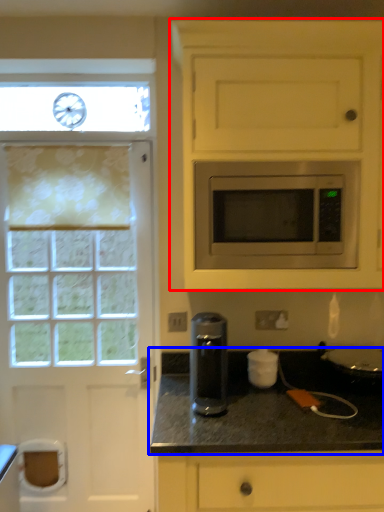
Question: Which object appears farthest to the camera in this image, cabinetry (highlighted by a red box) or countertop (highlighted by a blue box)?

Choices:
 (A) cabinetry
 (B) countertop

Answer: (A)